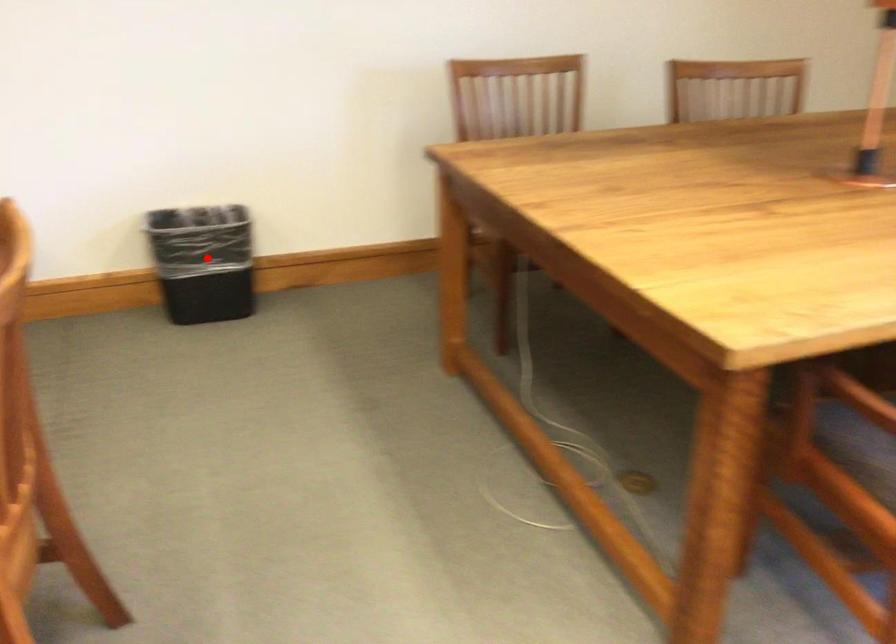
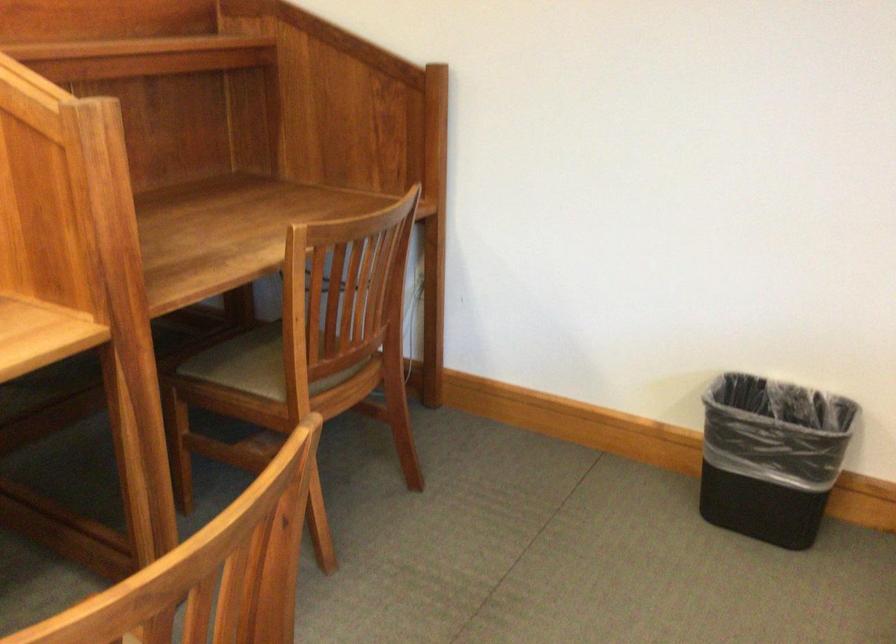
Locate, in the second image, the point that corresponds to the highlighted location in the first image.

(771, 456)